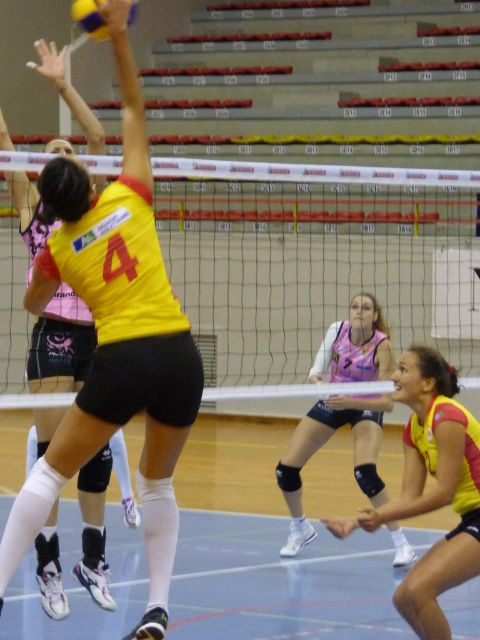
How much distance is there between beige mesh net at center and yellow matte jersey at center?

The distance of beige mesh net at center from yellow matte jersey at center is 4.66 meters.

Image resolution: width=480 pixels, height=640 pixels. Describe the element at coordinates (314, 260) in the screenshot. I see `beige mesh net at center` at that location.

Identify the location of beige mesh net at center. (314, 260).

Locate an element on the screen. beige mesh net at center is located at coordinates (314, 260).

Between point (417, 580) and point (71, 8), which one is positioned behind?

Point (71, 8)

How much distance is there between yellow matte jersey at lower right and yellow matte volleyball at upper left?

A distance of 12.66 feet exists between yellow matte jersey at lower right and yellow matte volleyball at upper left.

Is point (445, 394) closer to camera compared to point (95, 24)?

No.

What are the coordinates of `yellow matte jersey at lower right` in the screenshot? It's located at (x=432, y=486).

Can you confirm if yellow matte jersey at center is smaller than yellow matte volleyball at upper left?

Yes.

The width and height of the screenshot is (480, 640). I want to click on yellow matte jersey at center, so click(x=115, y=339).